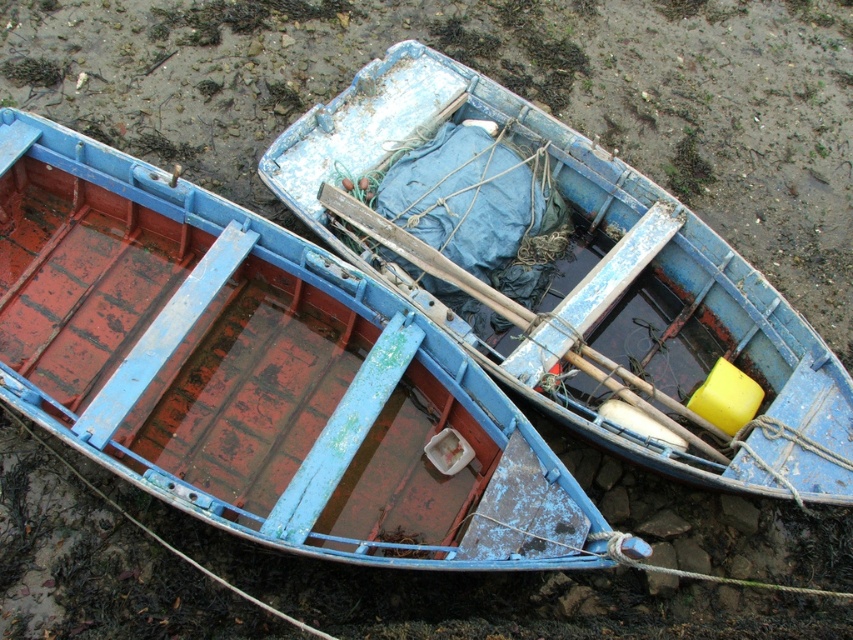
In the scene shown: Who is positioned more to the right, rusty metal boat at lower left or blue painted wood boat at center?

blue painted wood boat at center

Is point (279, 381) more distant than point (692, 435)?

Yes, it is.

Locate an element on the screen. rusty metal boat at lower left is located at coordinates (258, 374).

Find the location of a particular element. rusty metal boat at lower left is located at coordinates (258, 374).